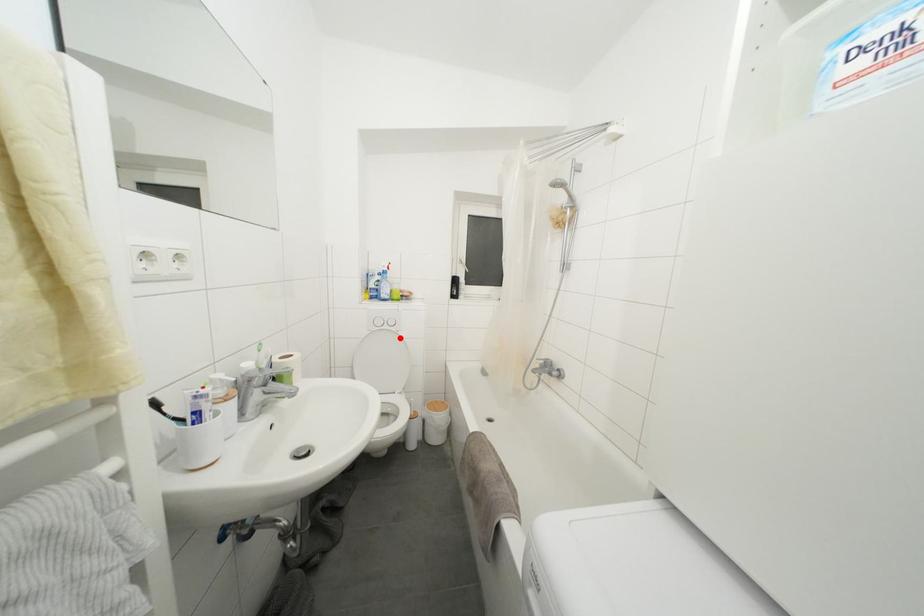
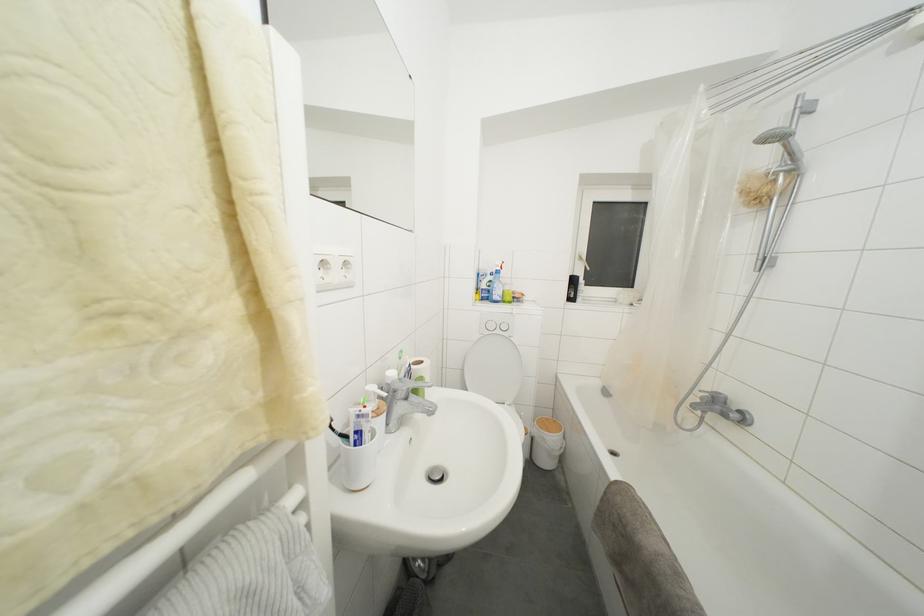
Find the pixel in the second image that matches the highlighted location in the first image.

(513, 344)